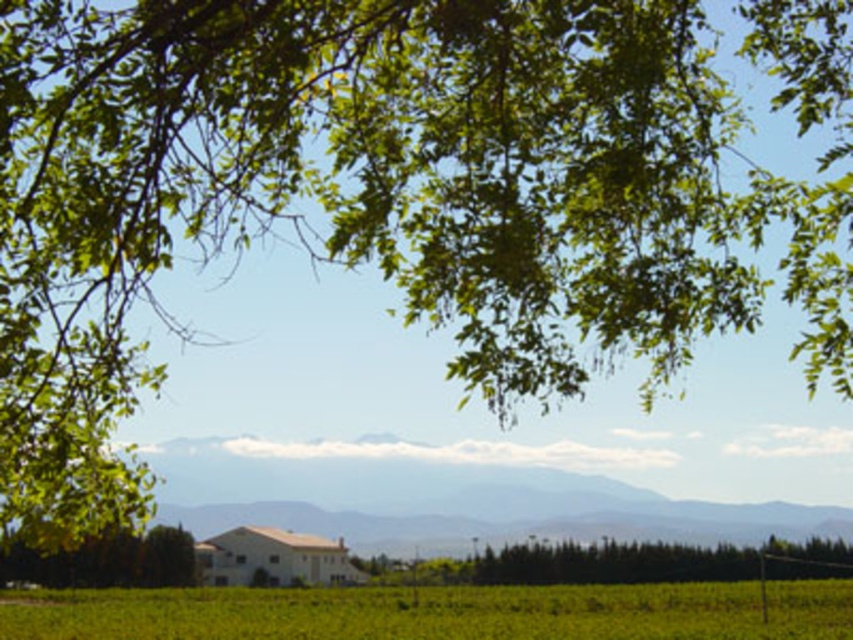
Question: Does green grass at lower center appear on the right side of green leafy tree at center?

Choices:
 (A) yes
 (B) no

Answer: (B)

Question: Which point is farther to the camera?

Choices:
 (A) green grass at lower center
 (B) green leafy tree at center

Answer: (B)

Question: Which point is closer to the camera?

Choices:
 (A) green leafy tree at center
 (B) green leafy tree at lower left

Answer: (B)

Question: Can you confirm if green grass at lower center is positioned to the left of green leafy tree at lower left?

Choices:
 (A) no
 (B) yes

Answer: (A)

Question: Does green grass at lower center have a smaller size compared to green leafy tree at center?

Choices:
 (A) yes
 (B) no

Answer: (B)

Question: Which point is farther from the camera taking this photo?

Choices:
 (A) (576, 600)
 (B) (824, 557)

Answer: (A)